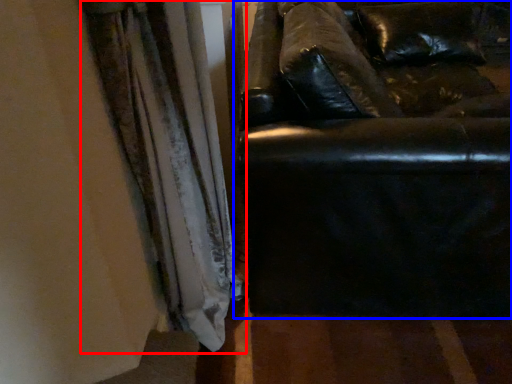
Question: Which point is closer to the camera, curtain (highlighted by a red box) or studio couch (highlighted by a blue box)?

Choices:
 (A) curtain
 (B) studio couch

Answer: (A)